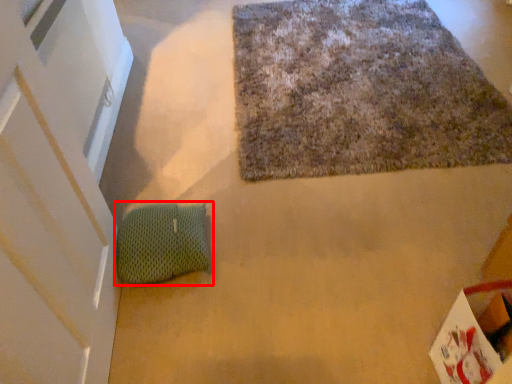
Question: From the image's perspective, what is the correct spatial relationship of bean bag chair (annotated by the red box) in relation to mat?

Choices:
 (A) above
 (B) below

Answer: (B)